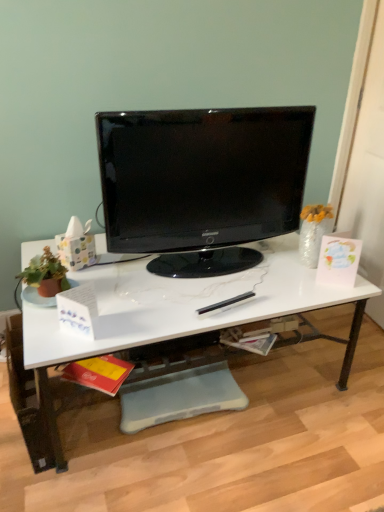
Find the location of a particular element. This screenshot has height=512, width=384. black glossy monitor at center is located at coordinates (202, 184).

Describe the element at coordinates (202, 184) in the screenshot. I see `black glossy monitor at center` at that location.

What is the approximate width of black glossy monitor at center?

10.58 inches.

You are a GUI agent. You are given a task and a screenshot of the screen. Output one action in this format:
    pyautogui.click(x=<x>, y=<y>)
    Task: Click on the white marble desk at center
    
    Given the screenshot: What is the action you would take?
    pyautogui.click(x=180, y=313)

Image resolution: width=384 pixels, height=512 pixels. Describe the element at coordinates (180, 313) in the screenshot. I see `white marble desk at center` at that location.

Identify the location of black glossy monitor at center. The height and width of the screenshot is (512, 384). (202, 184).

Looking at this image, which is more to the right, black glossy monitor at center or white marble desk at center?

Positioned to the right is black glossy monitor at center.

Does black glossy monitor at center lie in front of white marble desk at center?

No, black glossy monitor at center is behind white marble desk at center.

Considering the points (209, 127) and (149, 293), which point is in front, point (209, 127) or point (149, 293)?

The point (209, 127) is closer.

From the image's perspective, which one is positioned higher, black glossy monitor at center or white marble desk at center?

black glossy monitor at center, from the image's perspective.

From a real-world perspective, is black glossy monitor at center positioned under white marble desk at center based on gravity?

Incorrect, from a real-world perspective, black glossy monitor at center is higher than white marble desk at center.

Consider the image. Which of these two, black glossy monitor at center or white marble desk at center, is wider?

Wider between the two is white marble desk at center.

Does black glossy monitor at center have a greater height compared to white marble desk at center?

Yes.

Based on the photo, considering the sizes of objects black glossy monitor at center and white marble desk at center in the image provided, who is smaller, black glossy monitor at center or white marble desk at center?

With smaller size is black glossy monitor at center.

Choose the correct answer: Is black glossy monitor at center inside white marble desk at center or outside it?

black glossy monitor at center is spatially situated outside white marble desk at center.

Is black glossy monitor at center next to white marble desk at center?

No.

Is black glossy monitor at center positioned with its back to white marble desk at center?

No.

Where is `computer monitor above the white marble desk at center (from the image's perspective)`? The width and height of the screenshot is (384, 512). computer monitor above the white marble desk at center (from the image's perspective) is located at coordinates (202, 184).

Considering the positions of objects white marble desk at center and black glossy monitor at center in the image provided, who is more to the left, white marble desk at center or black glossy monitor at center?

Positioned to the left is white marble desk at center.

Consider the image. Relative to black glossy monitor at center, is white marble desk at center in front or behind?

Clearly, white marble desk at center is in front of black glossy monitor at center.

Is point (120, 342) farther from camera compared to point (211, 253)?

No, (120, 342) is closer to viewer.

From the image's perspective, which is above, white marble desk at center or black glossy monitor at center?

black glossy monitor at center is shown above in the image.

From a real-world perspective, who is located lower, white marble desk at center or black glossy monitor at center?

In real-world perspective, white marble desk at center is lower.

Considering the sizes of white marble desk at center and black glossy monitor at center in the image, is white marble desk at center wider or thinner than black glossy monitor at center?

Clearly, white marble desk at center has more width compared to black glossy monitor at center.

Considering the sizes of objects white marble desk at center and black glossy monitor at center in the image provided, who is taller, white marble desk at center or black glossy monitor at center?

black glossy monitor at center is taller.

Who is bigger, white marble desk at center or black glossy monitor at center?

white marble desk at center.

Is black glossy monitor at center inside white marble desk at center?

No, black glossy monitor at center is not inside white marble desk at center.

Is the surface of white marble desk at center in direct contact with black glossy monitor at center?

They are not placed beside each other.

Is black glossy monitor at center at the back of white marble desk at center?

white marble desk at center is not turned away from black glossy monitor at center.

How many degrees apart are the facing directions of white marble desk at center and black glossy monitor at center?

The angle between the facing direction of white marble desk at center and the facing direction of black glossy monitor at center is 3.32 degrees.

At what (x,y) coordinates should I click in order to perform the action: click on desk on the left side of black glossy monitor at center. Please return your answer as a coordinate pair (x, y). The image size is (384, 512). Looking at the image, I should click on (180, 313).

Locate an element on the screen. This screenshot has width=384, height=512. computer monitor behind the white marble desk at center is located at coordinates (202, 184).

The width and height of the screenshot is (384, 512). I want to click on desk located in front of the black glossy monitor at center, so click(x=180, y=313).